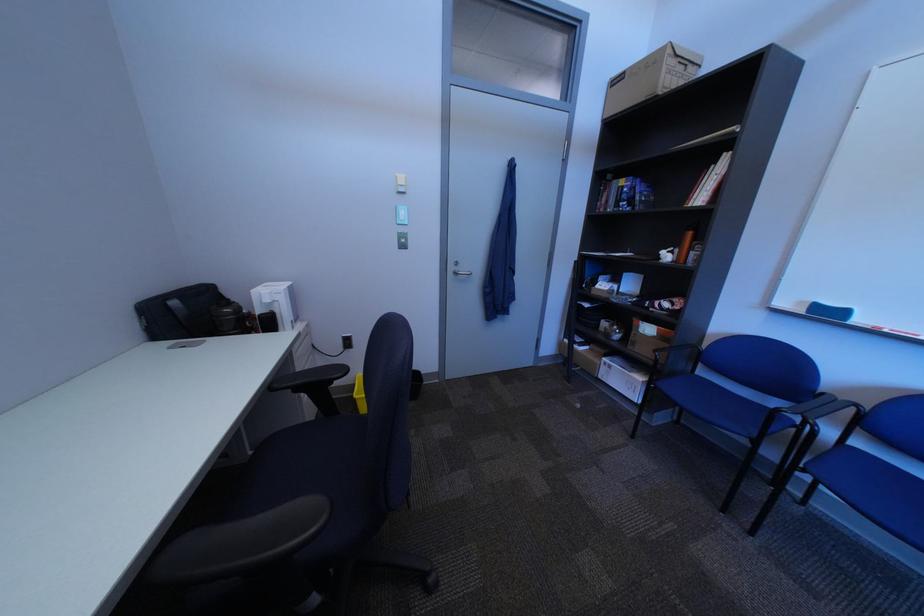
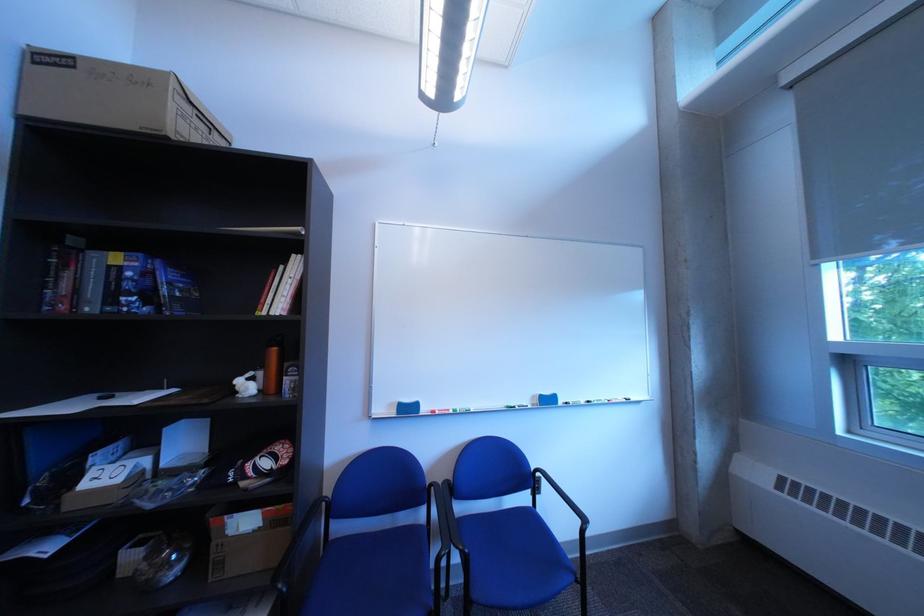
In the second image, find the point that corresponds to pixel 686 251 in the first image.

(264, 376)